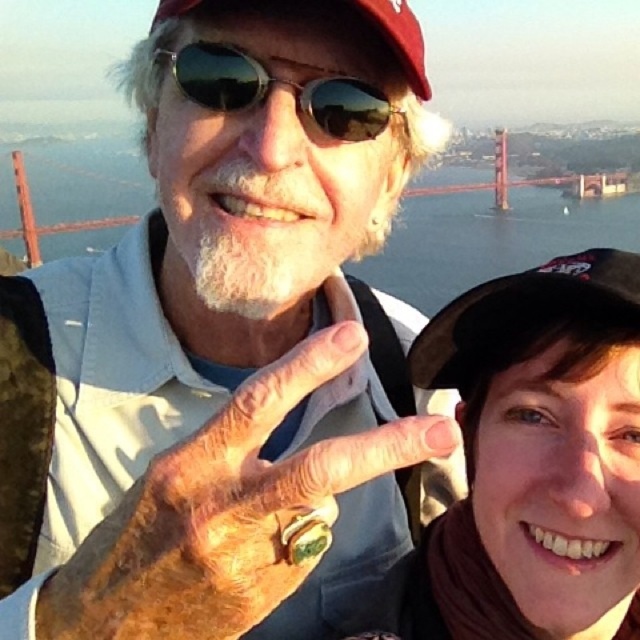
Question: Is matte black vest at center below black fabric baseball cap at right?

Choices:
 (A) no
 (B) yes

Answer: (B)

Question: Which of the following is the farthest from the observer?

Choices:
 (A) (595, 188)
 (B) (184, 163)

Answer: (A)

Question: From the image, what is the correct spatial relationship of black fabric baseball cap at right in relation to sunglasses at center?

Choices:
 (A) below
 (B) above

Answer: (A)

Question: Considering the relative positions of sunglasses at center and red painted steel bridge at upper right in the image provided, where is sunglasses at center located with respect to red painted steel bridge at upper right?

Choices:
 (A) left
 (B) right

Answer: (A)

Question: Which of the following is the farthest from the observer?

Choices:
 (A) (612, 186)
 (B) (148, 308)
 (C) (560, 289)

Answer: (A)

Question: Which point is closer to the camera?

Choices:
 (A) sunglasses at center
 (B) matte black vest at center
 (C) maroon fabric baseball cap at upper center
 (D) red painted steel bridge at upper right

Answer: (B)